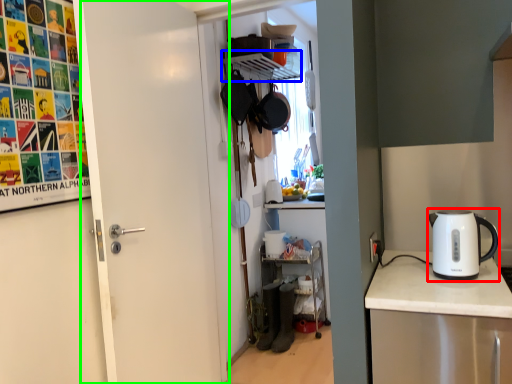
Question: Which object is the farthest from kettle (highlighted by a red box)? Choose among these: shelf (highlighted by a blue box) or door (highlighted by a green box).

Choices:
 (A) shelf
 (B) door

Answer: (A)